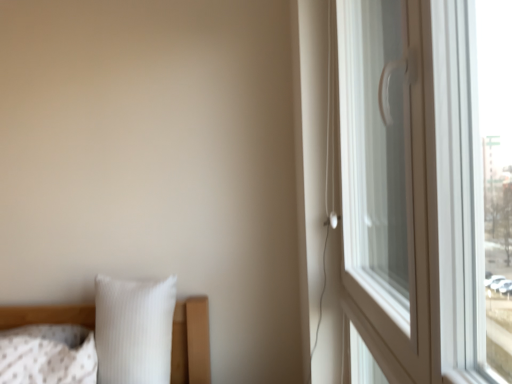
Question: Considering the relative positions of white glossy window handle at right and white ribbed pillow at lower left, which is counted as the first pillow, starting from the right, in the image provided, is white glossy window handle at right to the left of white ribbed pillow at lower left, which is counted as the first pillow, starting from the right, from the viewer's perspective?

Choices:
 (A) yes
 (B) no

Answer: (B)

Question: Is white ribbed pillow at lower left, which is counted as the first pillow, starting from the right, completely or partially inside white glossy window handle at right?

Choices:
 (A) no
 (B) yes

Answer: (A)

Question: Considering the relative sizes of white glossy window handle at right and white ribbed pillow at lower left, which is counted as the first pillow, starting from the right, in the image provided, is white glossy window handle at right shorter than white ribbed pillow at lower left, which is counted as the first pillow, starting from the right,?

Choices:
 (A) no
 (B) yes

Answer: (A)

Question: Can you confirm if white glossy window handle at right is bigger than white ribbed pillow at lower left, which is counted as the first pillow, starting from the right?

Choices:
 (A) yes
 (B) no

Answer: (A)

Question: From a real-world perspective, does white glossy window handle at right stand above white ribbed pillow at lower left, which appears as the second pillow when viewed from the left?

Choices:
 (A) no
 (B) yes

Answer: (B)

Question: Would you say white ribbed pillow at lower left, which is counted as the first pillow, starting from the right, is inside or outside white glossy window handle at right?

Choices:
 (A) inside
 (B) outside

Answer: (B)

Question: From a real-world perspective, relative to white glossy window handle at right, is white ribbed pillow at lower left, which is counted as the first pillow, starting from the right, vertically above or below?

Choices:
 (A) below
 (B) above

Answer: (A)

Question: Looking at their shapes, would you say white ribbed pillow at lower left, which appears as the second pillow when viewed from the left, is wider or thinner than white glossy window handle at right?

Choices:
 (A) wide
 (B) thin

Answer: (A)

Question: From the image's perspective, is white ribbed pillow at lower left, which is counted as the first pillow, starting from the right, located above or below white glossy window handle at right?

Choices:
 (A) below
 (B) above

Answer: (A)

Question: Is white textured pillow at lower left, marked as the 1th pillow in a left-to-right arrangement, wider or thinner than white glossy window handle at right?

Choices:
 (A) wide
 (B) thin

Answer: (A)

Question: Does point (3, 372) appear closer or farther from the camera than point (439, 195)?

Choices:
 (A) closer
 (B) farther

Answer: (B)

Question: From the image's perspective, is white textured pillow at lower left, marked as the 1th pillow in a left-to-right arrangement, located above or below white glossy window handle at right?

Choices:
 (A) below
 (B) above

Answer: (A)

Question: From a real-world perspective, relative to white glossy window handle at right, is white textured pillow at lower left, the 2th pillow in the right-to-left sequence, vertically above or below?

Choices:
 (A) above
 (B) below

Answer: (B)

Question: Is white glossy window handle at right taller or shorter than white textured pillow at lower left, marked as the 1th pillow in a left-to-right arrangement?

Choices:
 (A) short
 (B) tall

Answer: (B)

Question: From the image's perspective, is white glossy window handle at right located above or below white textured pillow at lower left, the 2th pillow in the right-to-left sequence?

Choices:
 (A) below
 (B) above

Answer: (B)